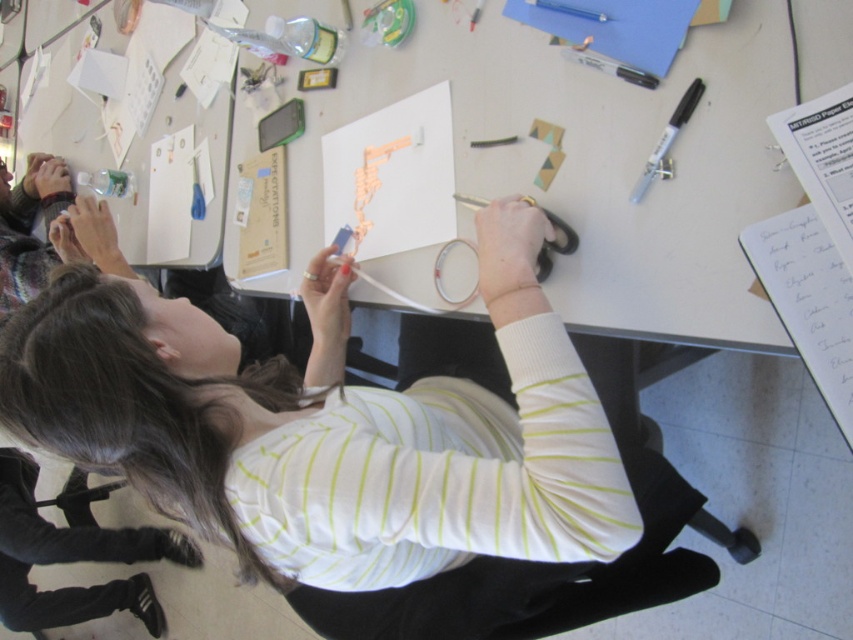
Question: Is white paper at center above black fabric pants at lower left?

Choices:
 (A) yes
 (B) no

Answer: (A)

Question: Considering the real-world distances, which object is closest to the orange foam letters at center?

Choices:
 (A) black fabric pants at lower left
 (B) black plastic marker at upper right
 (C) white striped shirt at center
 (D) white paper at center

Answer: (D)

Question: Which of the following is the closest to the observer?

Choices:
 (A) white striped shirt at center
 (B) white paper at center

Answer: (A)

Question: Does black fabric pants at lower left appear under black plastic marker at upper right?

Choices:
 (A) yes
 (B) no

Answer: (A)

Question: Which of the following is the farthest from the observer?

Choices:
 (A) (16, 474)
 (B) (357, 200)
 (C) (492, 289)
 (D) (691, 109)

Answer: (A)

Question: Is the position of white striped shirt at center more distant than that of black plastic marker at upper right?

Choices:
 (A) no
 (B) yes

Answer: (A)